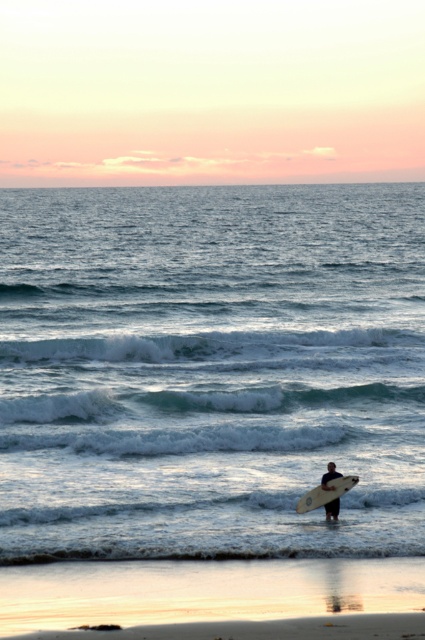
Question: Estimate the real-world distances between objects in this image. Which object is closer to the smooth white surfboard at lower center?

Choices:
 (A) white frothy wave at center
 (B) blue water at center
 (C) smooth sand at lower center

Answer: (C)

Question: Which of these objects is positioned closest to the smooth white surfboard at lower center?

Choices:
 (A) white frothy wave at center
 (B) greenish-blue foam at lower center
 (C) white foam surfboard at lower center
 (D) smooth sand at lower center

Answer: (C)

Question: Considering the relative positions of smooth sand at lower center and smooth white surfboard at lower center in the image provided, where is smooth sand at lower center located with respect to smooth white surfboard at lower center?

Choices:
 (A) right
 (B) left

Answer: (B)

Question: Does greenish-blue foam at lower center appear on the left side of white foam surfboard at lower center?

Choices:
 (A) yes
 (B) no

Answer: (A)

Question: Is smooth sand at lower center above greenish-blue foam at lower center?

Choices:
 (A) yes
 (B) no

Answer: (B)

Question: Which point is farther to the camera?

Choices:
 (A) blue water at center
 (B) smooth white surfboard at lower center

Answer: (B)